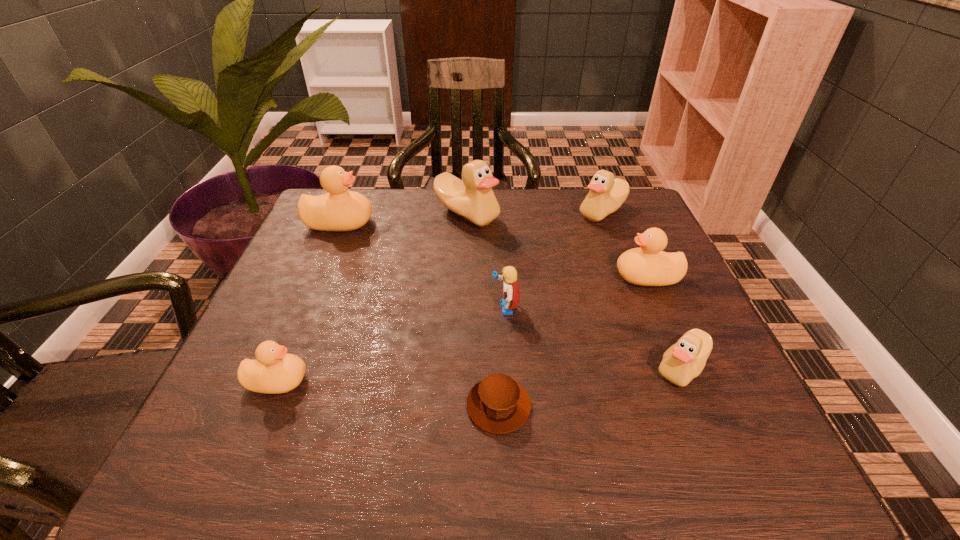
The image size is (960, 540). I want to click on vacant space located 0.060m on the front-facing side of the Lego, so click(463, 308).

Locate an element on the screen. This screenshot has height=540, width=960. vacant region located 0.110m on the front-facing side of the Lego is located at coordinates (440, 308).

This screenshot has width=960, height=540. I want to click on free space located 0.080m at the beak of the nearest beige duck, so click(x=610, y=367).

Identify the location of vacant space located at the beak of the nearest beige duck. Image resolution: width=960 pixels, height=540 pixels. (444, 367).

I want to click on free region located 0.360m at the beak of the nearest beige duck, so click(460, 367).

I want to click on vacant space situated on the face of the nearest yellow duck, so click(423, 381).

Find the location of a particular element. vacant space located on the back of the shortest object is located at coordinates (493, 264).

In order to click on object present at the near edge in this screenshot , I will do `click(497, 404)`.

Find the location of a particular element. This screenshot has height=540, width=960. object present at the far left corner is located at coordinates (338, 210).

Where is `object located in the far right corner section of the desktop`? object located in the far right corner section of the desktop is located at coordinates (607, 194).